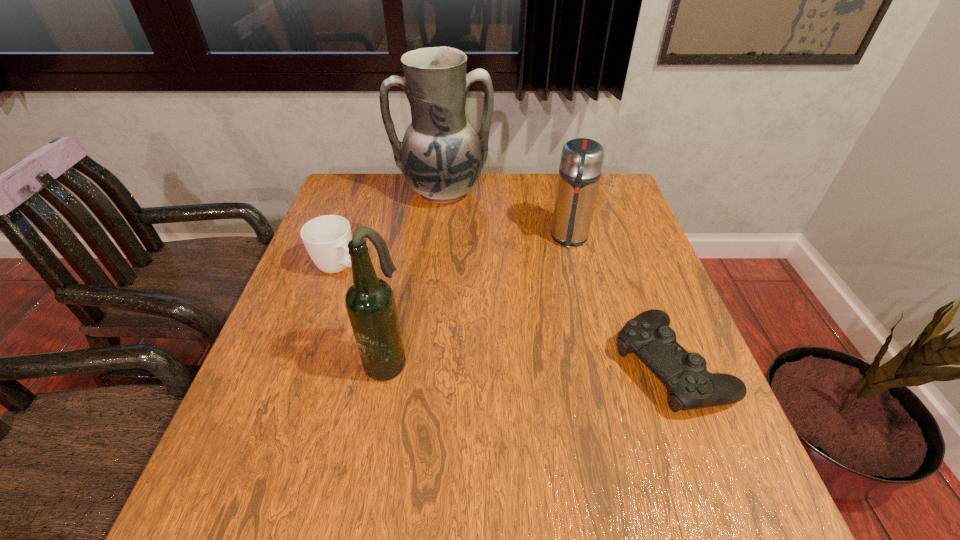
What are the coordinates of `free spot on the desktop that is between the fourth shortest object and the control and is positioned with a handle on the side of the third shortest object` in the screenshot? It's located at (551, 363).

Locate an element on the screen. The height and width of the screenshot is (540, 960). free space on the desktop that is between the second tallest object and the control and is positioned with the handle on the side of the cup is located at coordinates (492, 362).

Locate an element on the screen. The width and height of the screenshot is (960, 540). free space on the desktop that is between the second tallest object and the control and is positioned on the front-facing side of the tallest object is located at coordinates (488, 362).